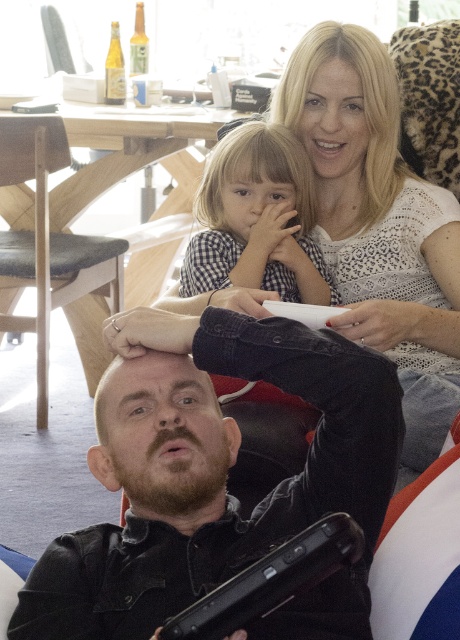
You are a photographer setting up for a family portrait in the living room. You need to place a small prop exactly where the checkered fabric dress at center is located. According to the scene description, what are the coordinates of the location where you should place the prop?

The checkered fabric dress at center is located at coordinates point (x=257, y=220), so you should place the prop at that exact point.

You are a photographer setting up a shoot in this living room. You need to place a small tripod between the dark brown leather jacket at lower left and the light brown wooden chair at left. Based on their positions, which object should the tripod be closer to?

The dark brown leather jacket at lower left is positioned on the right side of light brown wooden chair at left, so the tripod should be placed closer to the light brown wooden chair at left since it is to the left of the jacket.